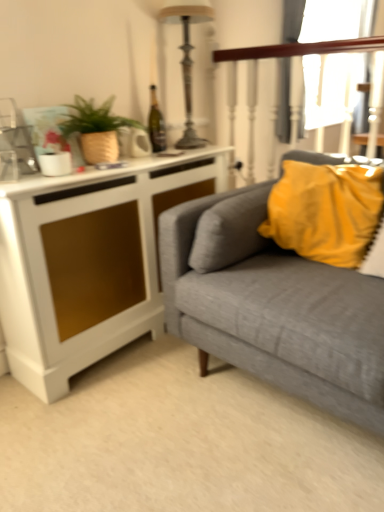
Question: Is wooden polished rail at upper right shorter than yellow fabric pillow at upper right?

Choices:
 (A) no
 (B) yes

Answer: (A)

Question: Does wooden polished rail at upper right appear on the left side of yellow fabric pillow at upper right?

Choices:
 (A) yes
 (B) no

Answer: (A)

Question: Could you tell me if wooden polished rail at upper right is facing yellow fabric pillow at upper right?

Choices:
 (A) no
 (B) yes

Answer: (A)

Question: Is wooden polished rail at upper right next to yellow fabric pillow at upper right?

Choices:
 (A) yes
 (B) no

Answer: (B)

Question: Considering the relative sizes of wooden polished rail at upper right and yellow fabric pillow at upper right in the image provided, is wooden polished rail at upper right smaller than yellow fabric pillow at upper right?

Choices:
 (A) no
 (B) yes

Answer: (B)

Question: Is yellow fabric pillow at upper right inside wooden polished rail at upper right?

Choices:
 (A) yes
 (B) no

Answer: (B)

Question: Is metallic silver lamp at upper center positioned far away from textured gray couch at right?

Choices:
 (A) no
 (B) yes

Answer: (B)

Question: Does metallic silver lamp at upper center have a smaller size compared to textured gray couch at right?

Choices:
 (A) yes
 (B) no

Answer: (A)

Question: Considering the relative positions of metallic silver lamp at upper center and textured gray couch at right in the image provided, is metallic silver lamp at upper center in front of textured gray couch at right?

Choices:
 (A) yes
 (B) no

Answer: (B)

Question: Does metallic silver lamp at upper center appear on the left side of textured gray couch at right?

Choices:
 (A) no
 (B) yes

Answer: (B)

Question: Is metallic silver lamp at upper center not within textured gray couch at right?

Choices:
 (A) yes
 (B) no

Answer: (A)

Question: Is metallic silver lamp at upper center oriented towards textured gray couch at right?

Choices:
 (A) no
 (B) yes

Answer: (B)

Question: Is white matte cabinet at left thinner than wooden polished rail at upper right?

Choices:
 (A) no
 (B) yes

Answer: (A)